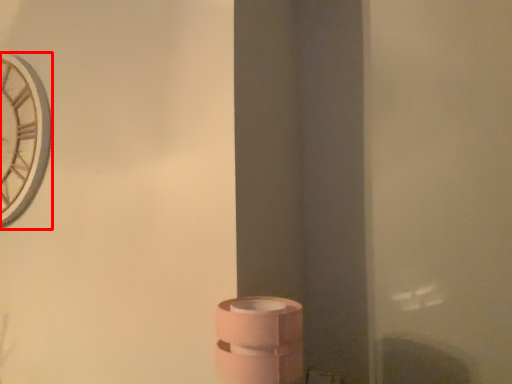
Question: From the image's perspective, where is clock (annotated by the red box) located relative to toilet paper?

Choices:
 (A) above
 (B) below

Answer: (A)